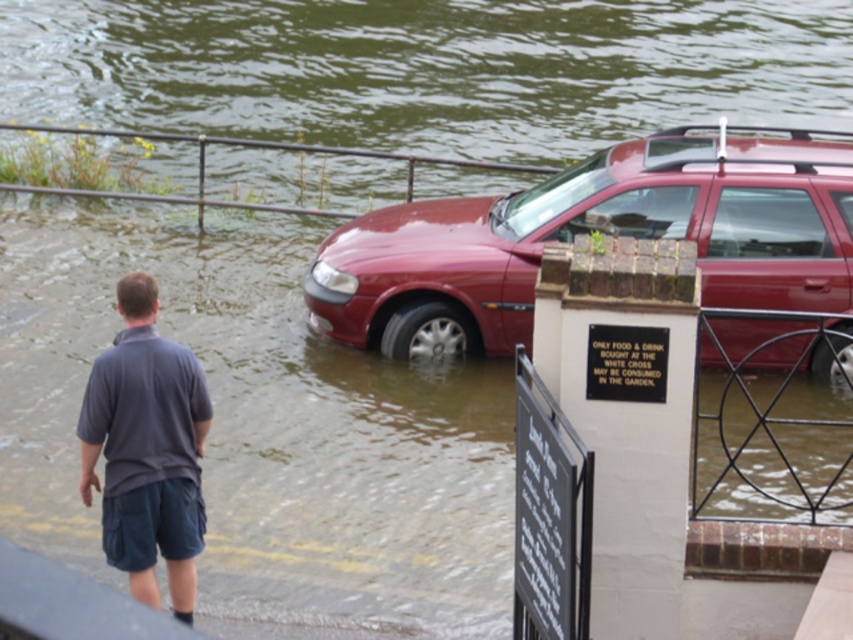
You are a rescue worker assessing the scene. You notice the shiny red car at center and the black stone sign at lower right. Which object would block your view more if you were standing behind them?

The shiny red car at center is larger in size than the black stone sign at lower right, so it would block your view more if you were standing behind them.